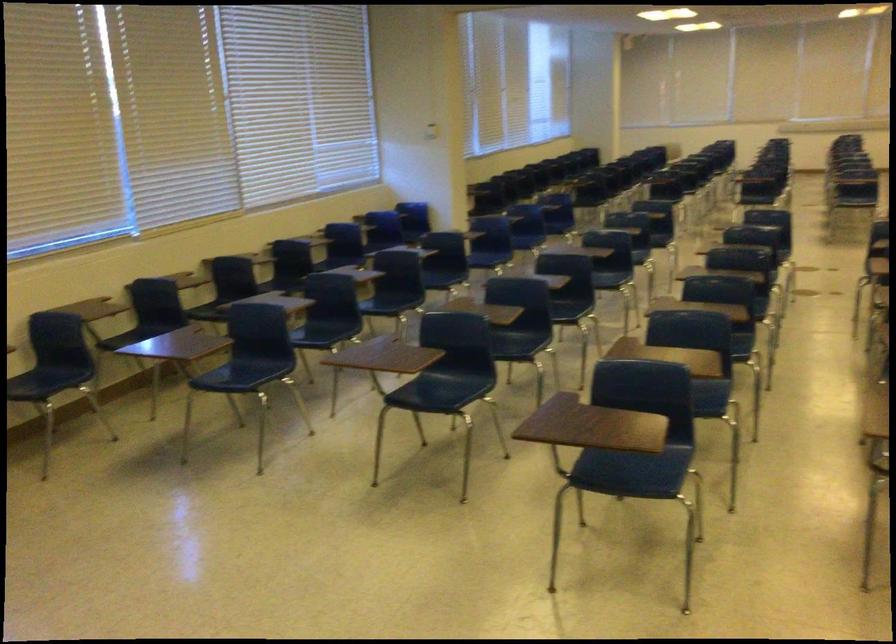
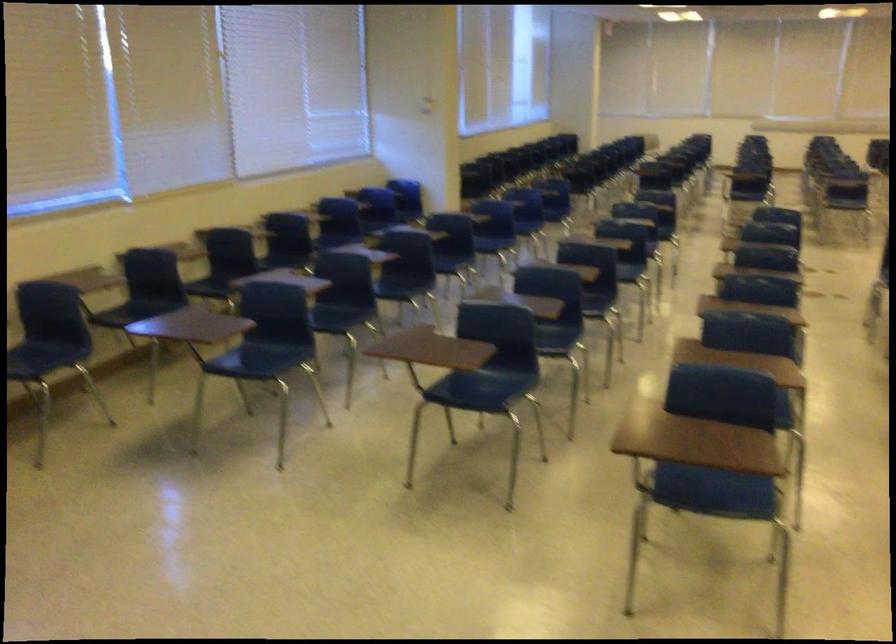
The images are taken continuously from a first-person perspective. In which direction are you moving?

The movement direction of the cameraman is left, forward.